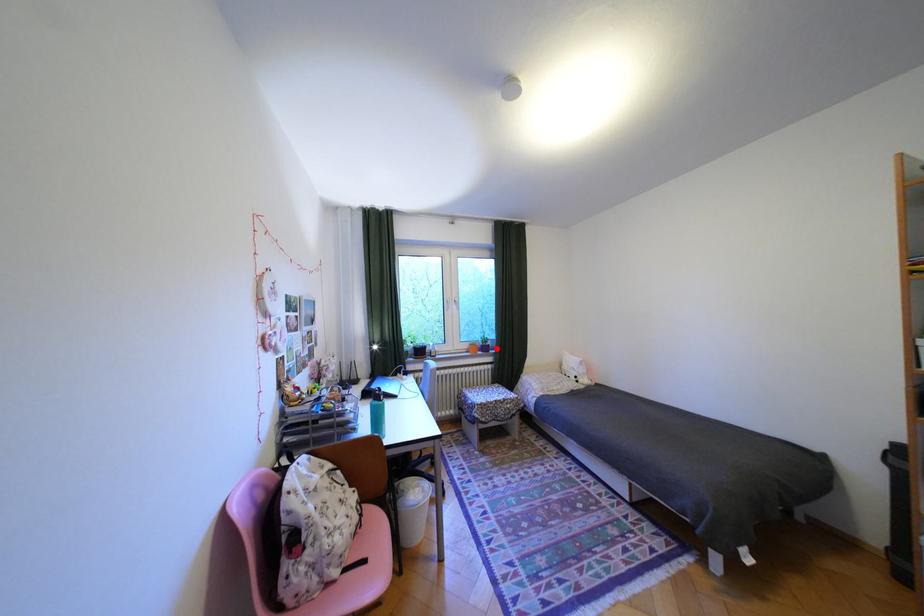
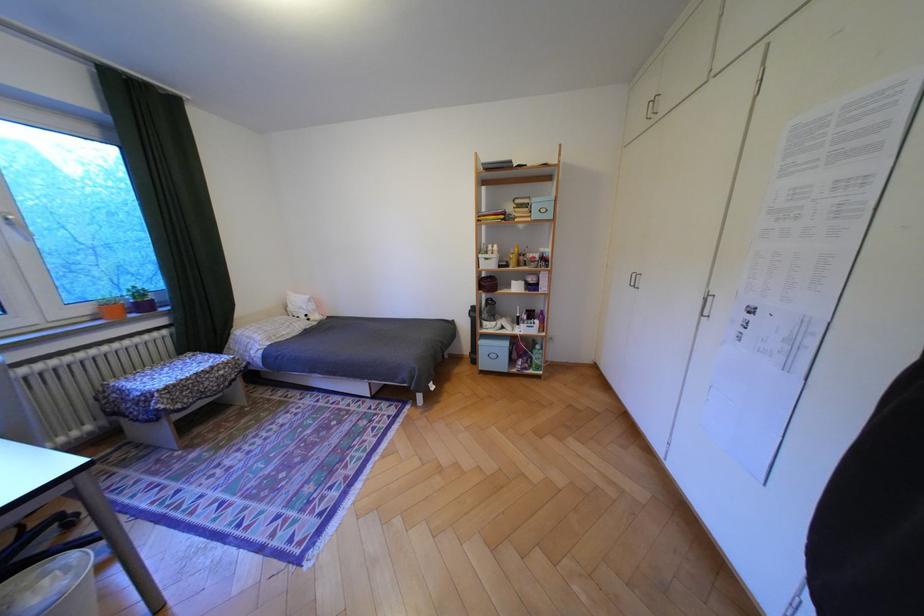
Question: I am providing you with two images of the same scene from different viewpoints. Given a red point in image1, look at the same physical point in image2. Is it:

Choices:
 (A) Closer to the viewpoint
 (B) Farther from the viewpoint

Answer: (A)